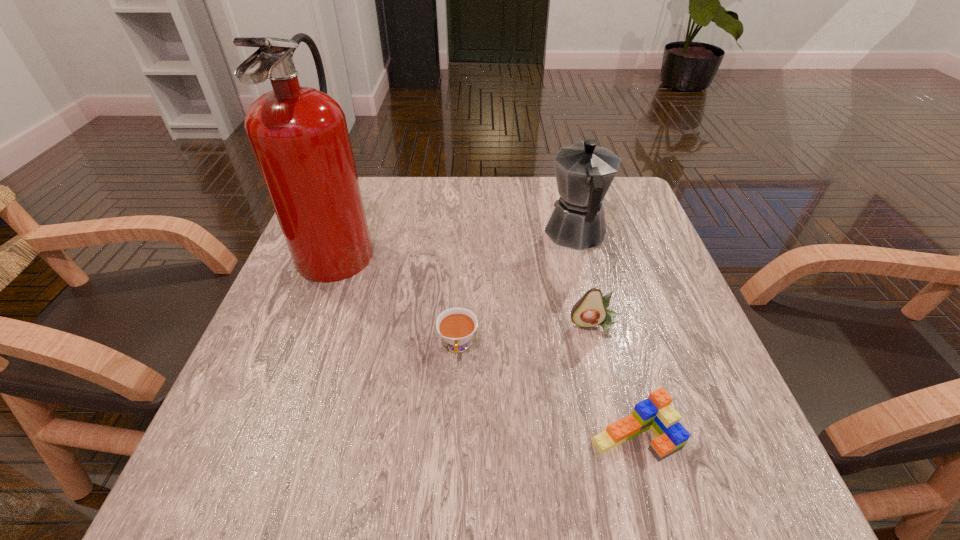
The image size is (960, 540). Find the location of `free space that satisfies the following two spatial constraints: 1. with the handle and nozzle on the leftmost object; 2. on the back side of the Lego`. free space that satisfies the following two spatial constraints: 1. with the handle and nozzle on the leftmost object; 2. on the back side of the Lego is located at coordinates (268, 436).

In order to click on blank space that satisfies the following two spatial constraints: 1. on the seed side of the third shortest object; 2. on the right side of the nearest object in this screenshot , I will do `click(622, 436)`.

This screenshot has height=540, width=960. I want to click on blank space that satisfies the following two spatial constraints: 1. with the handle and nozzle on the nearest object; 2. on the left side of the leftmost object, so click(268, 436).

Locate an element on the screen. free point that satisfies the following two spatial constraints: 1. on the back side of the nearest object; 2. with the handle and nozzle on the leftmost object is located at coordinates (583, 246).